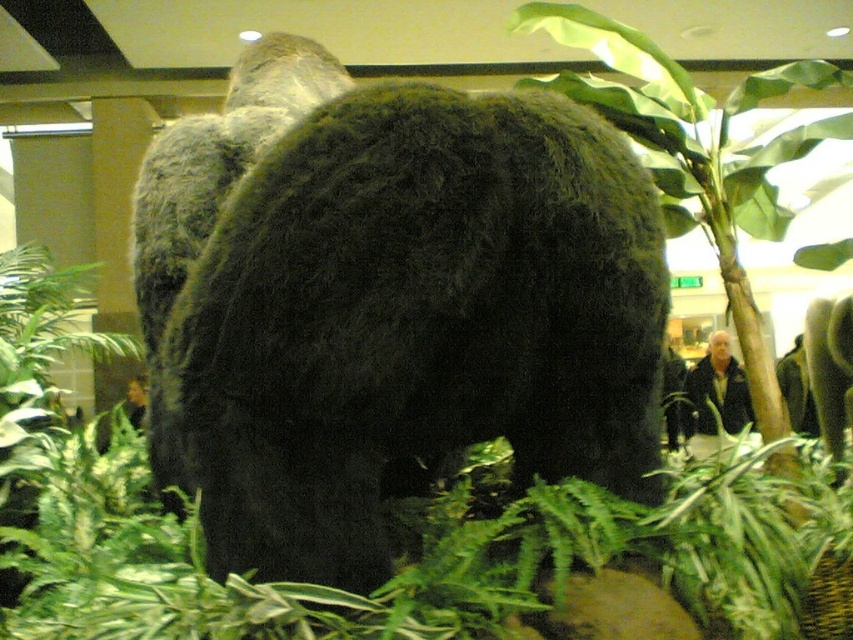
Can you confirm if black fuzzy bear at center is smaller than green leafy fern at center?

Yes, black fuzzy bear at center is smaller than green leafy fern at center.

Can you confirm if black fuzzy bear at center is positioned to the right of green leafy fern at center?

Incorrect, black fuzzy bear at center is not on the right side of green leafy fern at center.

Is point (381, 483) closer to viewer compared to point (664, 90)?

Yes, point (381, 483) is in front of point (664, 90).

At what (x,y) coordinates should I click in order to perform the action: click on black fuzzy bear at center. Please return your answer as a coordinate pair (x, y). The height and width of the screenshot is (640, 853). Looking at the image, I should click on (412, 323).